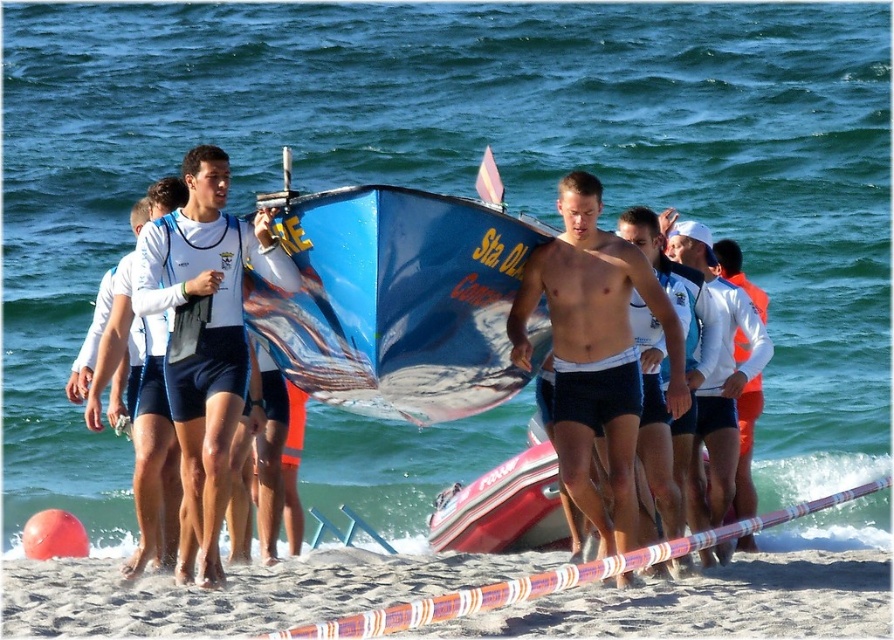
Question: Which object appears farthest from the camera in this image?

Choices:
 (A) smooth navy shorts at center
 (B) shiny blue shorts at center
 (C) blue glossy surfboard at center
 (D) white matte shorts at left

Answer: (D)

Question: Estimate the real-world distances between objects in this image. Which object is closer to the white matte shorts at left?

Choices:
 (A) white matte jacket at upper center
 (B) white sand at lower center
 (C) blue glossy surfboard at center
 (D) shiny blue shorts at center

Answer: (C)

Question: Which object is the closest to the white matte shorts at left?

Choices:
 (A) white sand at lower center
 (B) blue glossy surfboard at center

Answer: (B)

Question: Is white matte jacket at upper center wider than white matte shorts at left?

Choices:
 (A) no
 (B) yes

Answer: (A)

Question: Can you confirm if white matte shorts at left is positioned below shiny blue shorts at center?

Choices:
 (A) no
 (B) yes

Answer: (B)

Question: Does matte white life vest at center appear over shiny blue shorts at center?

Choices:
 (A) no
 (B) yes

Answer: (B)